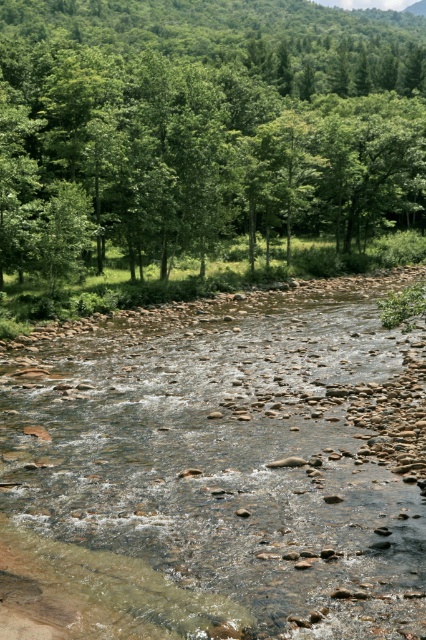
Question: Which point is farther to the camera?

Choices:
 (A) (97, 364)
 (B) (81, 140)

Answer: (B)

Question: Does clear water at center have a greater width compared to green leafy tree at upper center?

Choices:
 (A) yes
 (B) no

Answer: (B)

Question: From the image, what is the correct spatial relationship of clear water at center in relation to green leafy tree at upper center?

Choices:
 (A) above
 (B) below

Answer: (B)

Question: Which of the following is the farthest from the observer?

Choices:
 (A) clear water at center
 (B) green leafy tree at upper center

Answer: (B)

Question: Is clear water at center below green leafy tree at upper center?

Choices:
 (A) yes
 (B) no

Answer: (A)